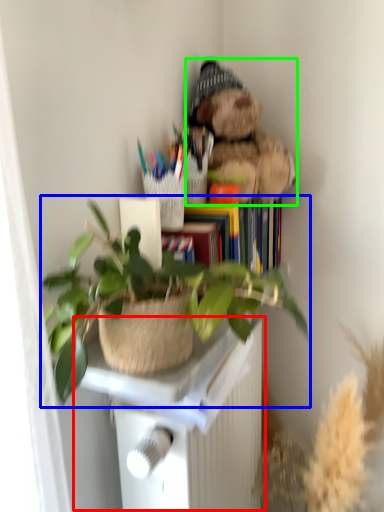
Question: Estimate the real-world distances between objects in this image. Which object is closer to table (highlighted by a red box), houseplant (highlighted by a blue box) or teddy bear (highlighted by a green box)?

Choices:
 (A) houseplant
 (B) teddy bear

Answer: (A)